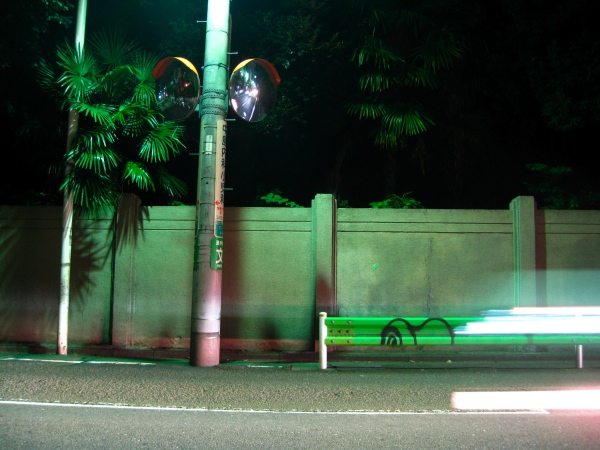
Where is `shadows on wall`? shadows on wall is located at coordinates (26, 251).